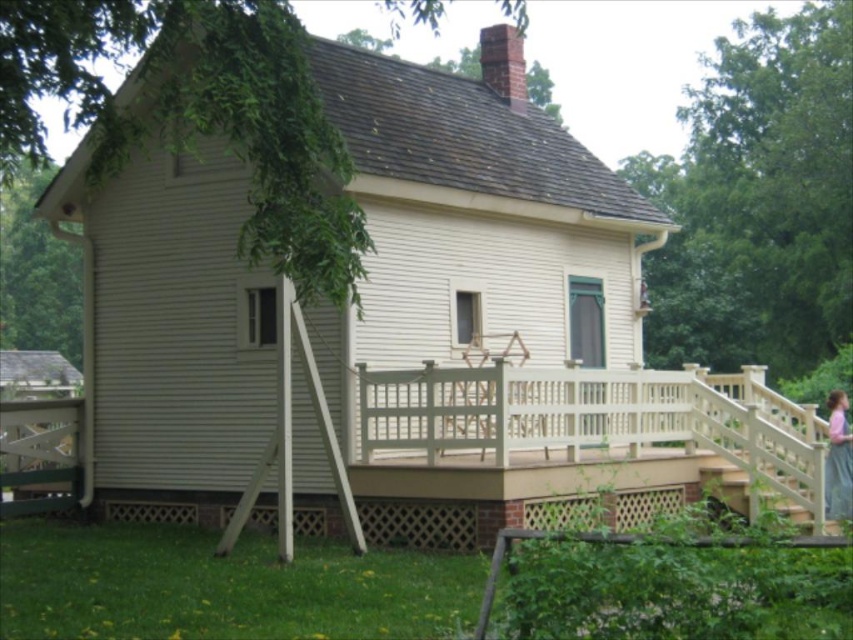
You are standing in front of the house and notice a pink fabric dress at upper right and white wooden stairs at lower right. Which object is positioned to the left of the other?

The white wooden stairs at lower right are to the left of the pink fabric dress at upper right.

You are standing on the lawn in front of the house and want to reach the pink fabric dress at upper right. Which direction should you move relative to the white wooden stairs at lower right?

The white wooden stairs at lower right are below the pink fabric dress at upper right, so you should move upward or towards the upper right direction relative to the white wooden stairs at lower right to reach the pink fabric dress at upper right.